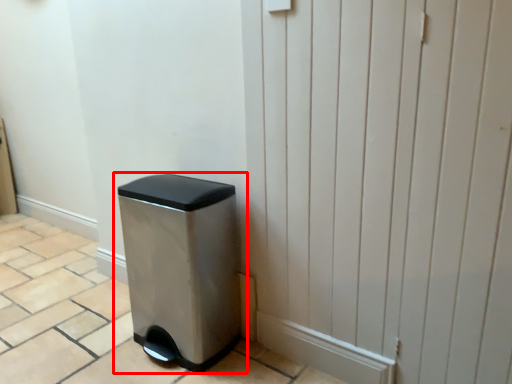
Question: Where is waste container (annotated by the red box) located in relation to screen door in the image?

Choices:
 (A) left
 (B) right

Answer: (A)